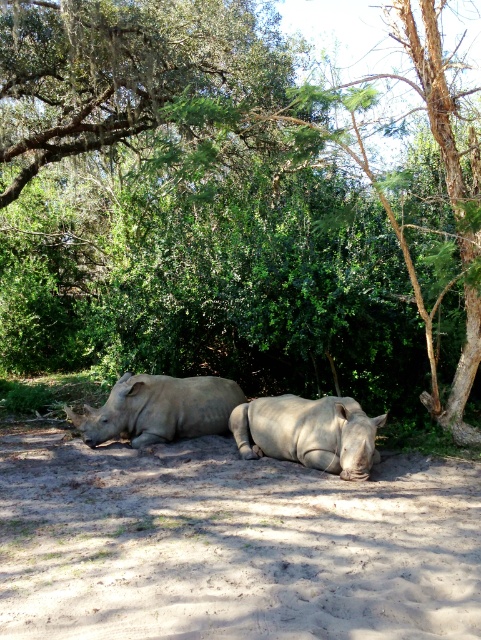
Question: From the image, what is the correct spatial relationship of sandy brown dirt at lower center in relation to smooth gray rhino at center?

Choices:
 (A) above
 (B) below

Answer: (B)

Question: Which point is closer to the camera taking this photo?

Choices:
 (A) (151, 499)
 (B) (257, 406)
 (C) (177, 220)

Answer: (A)

Question: From the image, what is the correct spatial relationship of brown textured tree at center in relation to gray matte rhinoceros at center?

Choices:
 (A) right
 (B) left

Answer: (B)

Question: Considering the real-world distances, which object is farthest from the smooth gray rhino at center?

Choices:
 (A) sandy brown dirt at lower center
 (B) brown textured tree at center

Answer: (B)

Question: Which of the following is the closest to the observer?

Choices:
 (A) gray matte rhinoceros at center
 (B) smooth gray rhino at center

Answer: (B)

Question: Can you confirm if sandy brown dirt at lower center is positioned below smooth gray rhino at center?

Choices:
 (A) no
 (B) yes

Answer: (B)